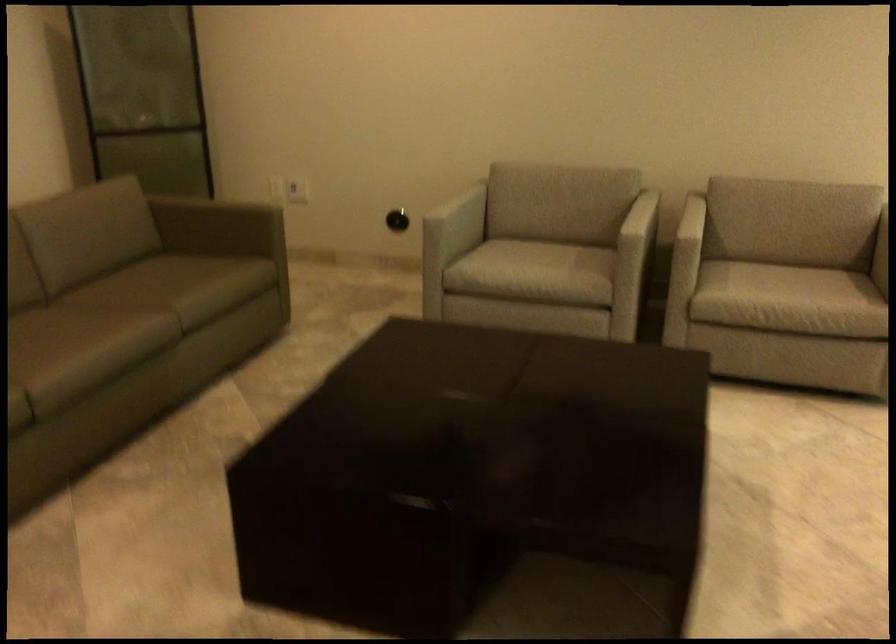
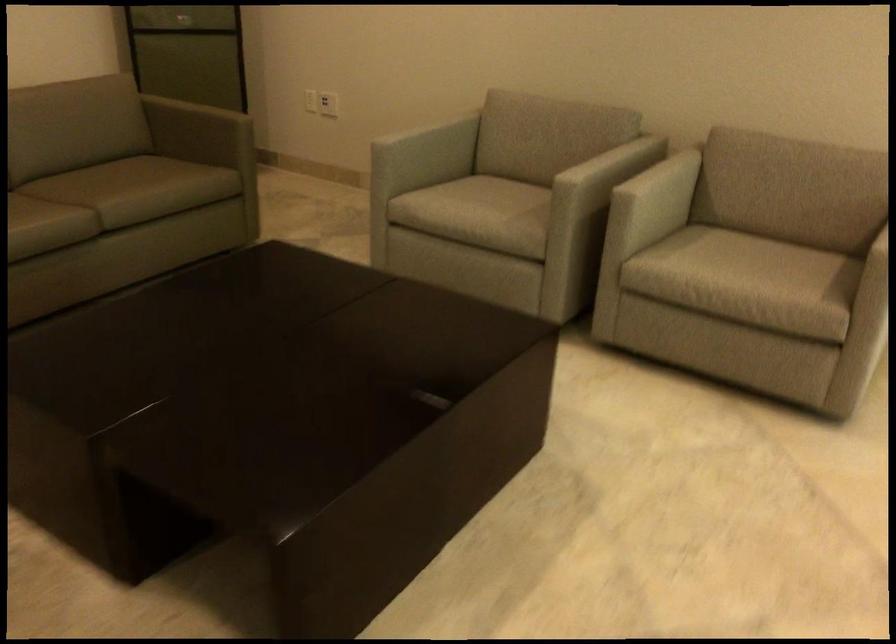
Locate, in the second image, the point that corresponds to [686,225] in the first image.

(661, 187)